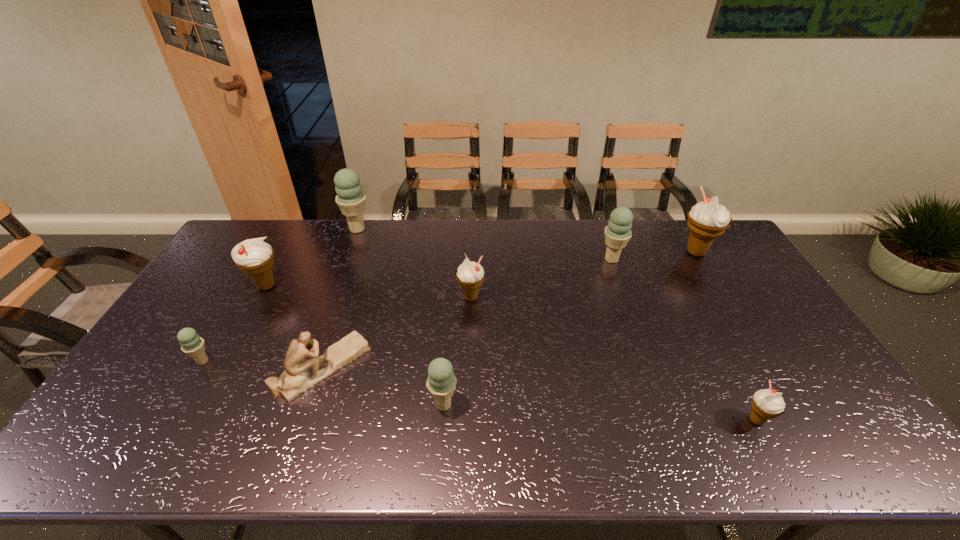
In order to click on vacant space that satisfies the following two spatial constraints: 1. on the front side of the leftmost white icecream; 2. on the right side of the third biggest white icecream in this screenshot , I will do `click(260, 298)`.

Locate an element on the screen. free space that satisfies the following two spatial constraints: 1. on the front side of the nearest white icecream; 2. on the left side of the second smallest blue ice cream is located at coordinates (443, 420).

At what (x,y) coordinates should I click in order to perform the action: click on vacant region that satisfies the following two spatial constraints: 1. on the front side of the third blue ice cream from right to left; 2. on the left side of the second smallest white icecream. Please return your answer as a coordinate pair (x, y). The height and width of the screenshot is (540, 960). Looking at the image, I should click on (332, 298).